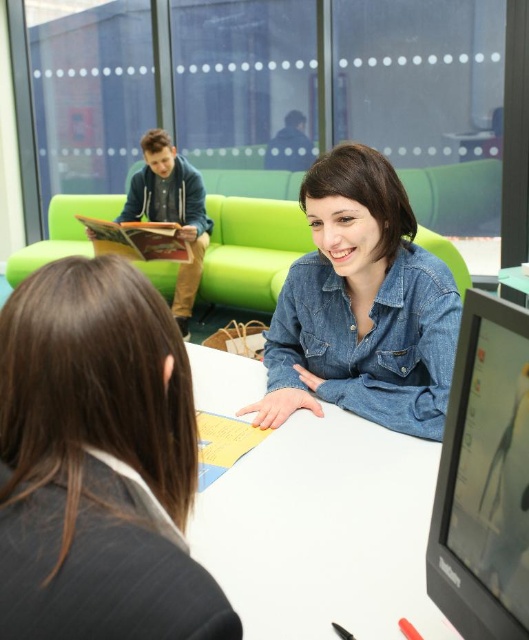
Does white glossy table at center have a lesser height compared to denim shirt at center?

Yes, white glossy table at center is shorter than denim shirt at center.

Which of these two, white glossy table at center or denim shirt at center, stands taller?

Standing taller between the two is denim shirt at center.

Between point (277, 492) and point (459, 326), which one is positioned in front?

Point (459, 326) is more forward.

This screenshot has height=640, width=529. What are the coordinates of `white glossy table at center` in the screenshot? It's located at (323, 531).

What do you see at coordinates (97, 461) in the screenshot? I see `denim jacket at center` at bounding box center [97, 461].

Is the position of denim jacket at center more distant than that of dark blue hoodie at upper left?

No, it is in front of dark blue hoodie at upper left.

Which is behind, point (169, 435) or point (176, 195)?

The point (176, 195) is behind.

You are a GUI agent. You are given a task and a screenshot of the screen. Output one action in this format:
    pyautogui.click(x=<x>, y=<y>)
    Task: Click on the denim jacket at center
    Image resolution: width=529 pixels, height=640 pixels.
    Given the screenshot: What is the action you would take?
    pyautogui.click(x=97, y=461)

Who is lower down, white glossy table at center or dark blue hoodie at upper left?

white glossy table at center

Is point (433, 636) closer to camera compared to point (143, 196)?

Yes.

Locate an element on the screen. white glossy table at center is located at coordinates (323, 531).